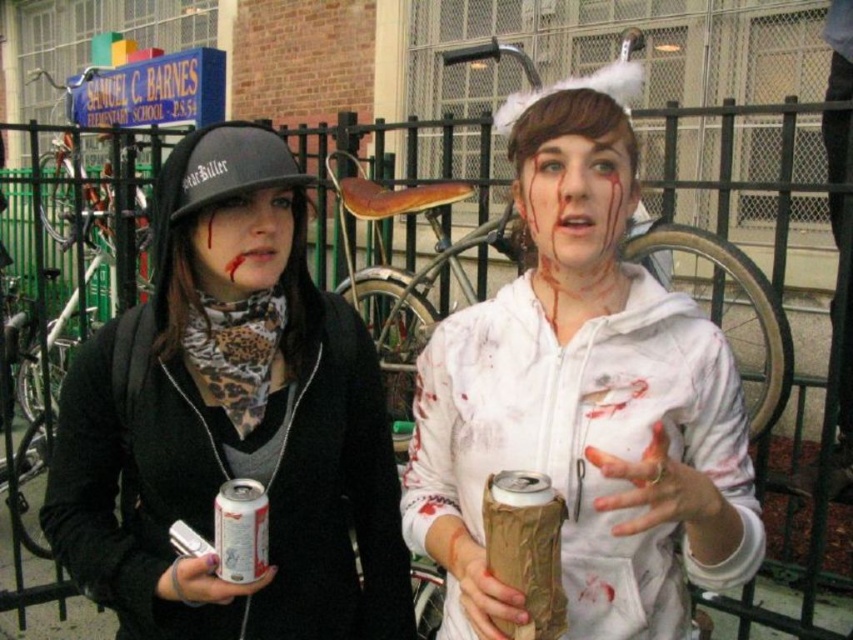
Question: Where is brown paper wrapped can at center located in relation to silver metallic can at center in the image?

Choices:
 (A) above
 (B) below

Answer: (A)

Question: Among these points, which one is nearest to the camera?

Choices:
 (A) (526, 524)
 (B) (207, 256)
 (C) (225, 268)

Answer: (A)

Question: Can you confirm if white paper cup at center is positioned to the right of matte black helmet at center?

Choices:
 (A) yes
 (B) no

Answer: (A)

Question: Which of the following is the farthest from the observer?

Choices:
 (A) pos(572,180)
 (B) pos(231,198)
 (C) pos(518,520)

Answer: (B)

Question: Among these points, which one is farthest from the camera?

Choices:
 (A) (566, 211)
 (B) (541, 292)
 (C) (277, 268)

Answer: (C)

Question: Does white matte face at center appear under brown paper wrapped can at center?

Choices:
 (A) no
 (B) yes

Answer: (A)